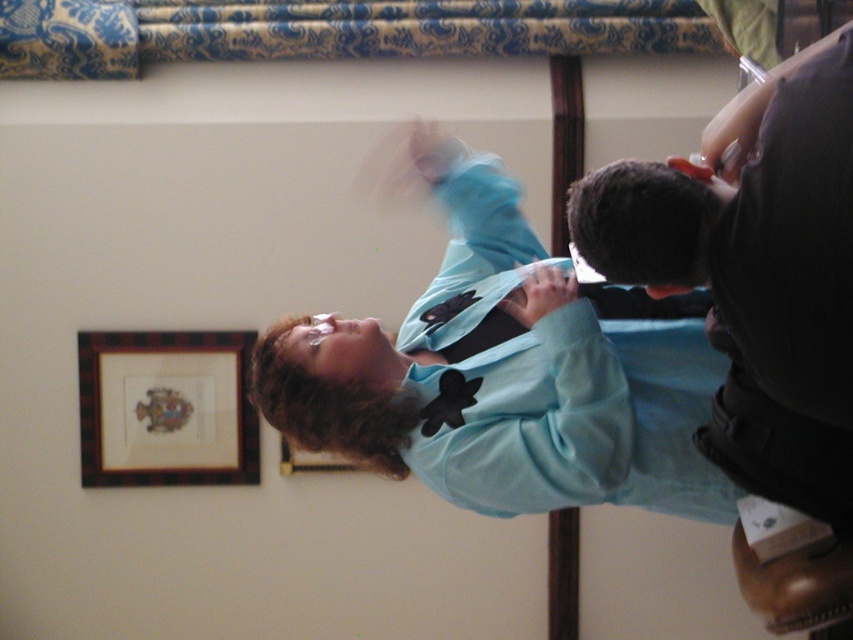
You are a stagehand setting up for a performance. The black satin bow tie at center is part of a costume prop, and the wooden plaque at center is a stage decoration. The stage requires that these two items be placed exactly 8 feet apart. Based on the scene description, will you need to adjust their positions?

The distance between the black satin bow tie at center and the wooden plaque at center is 7.87 feet, which is slightly less than the required 8 feet. Therefore, you should move them slightly apart to meet the 8 feet requirement.

You are at a formal event and see both the black satin bow tie at center and the wooden plaque at center. Which object is positioned to the right when facing the scene?

The black satin bow tie at center is positioned to the right of the wooden plaque at center.

You are standing in the room and want to place a new decoration between the wooden picture frame at upper left and the wooden plaque at center. Can you fit it there?

The wooden picture frame at upper left is to the left of the wooden plaque at center, so there is space between them to place the new decoration.